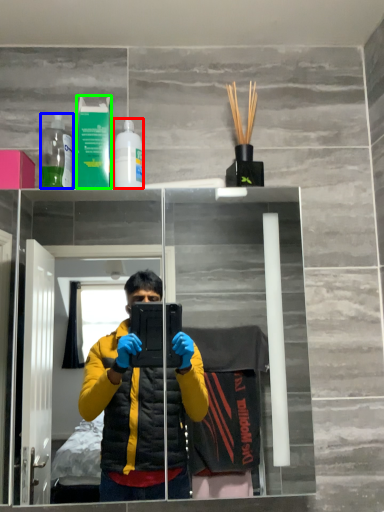
Question: Considering the real-world distances, which object is farthest from bottle (highlighted by a red box)? bottle (highlighted by a blue box) or mouthwash (highlighted by a green box)?

Choices:
 (A) bottle
 (B) mouthwash

Answer: (A)